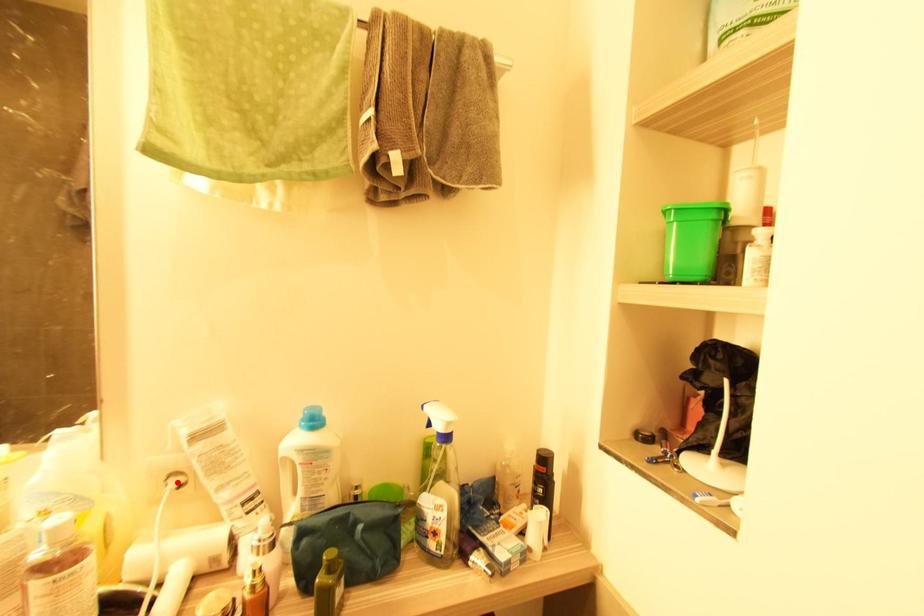
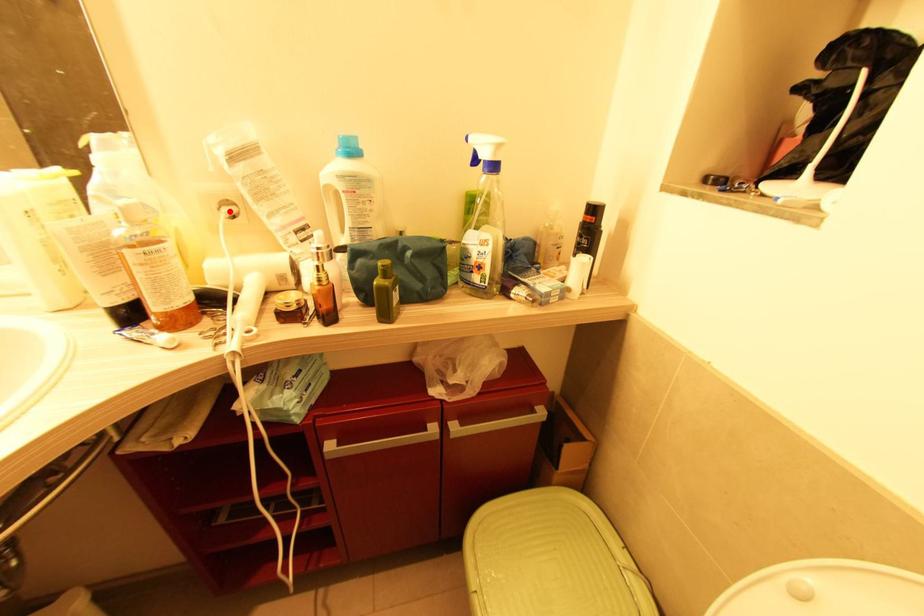
I am providing you with two images of the same scene from different viewpoints. A red point is marked on the first image and another point is marked on the second image. Are the points marked in image1 and image2 representing the same 3D position?

Yes